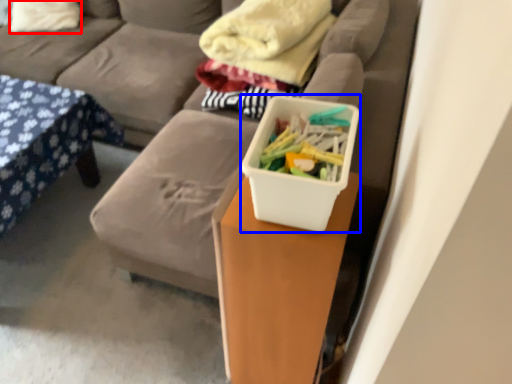
Question: Which object appears farthest to the camera in this image, pillow (highlighted by a red box) or storage box (highlighted by a blue box)?

Choices:
 (A) pillow
 (B) storage box

Answer: (A)